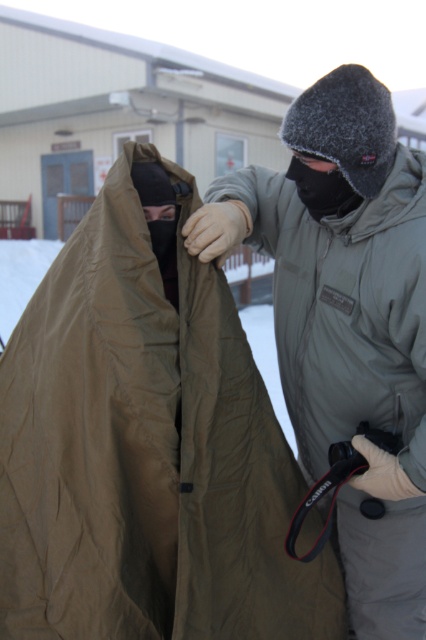
What do you see at coordinates (146, 445) in the screenshot?
I see `olive green fabric coat at center` at bounding box center [146, 445].

Which is behind, point (138, 385) or point (293, 122)?

Point (293, 122)

The width and height of the screenshot is (426, 640). In order to click on olive green fabric coat at center in this screenshot , I will do click(146, 445).